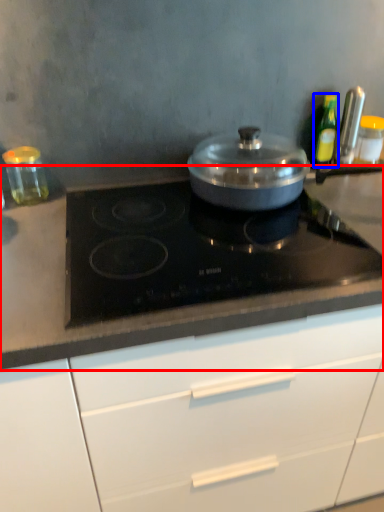
Question: Which object appears farthest to the camera in this image, countertop (highlighted by a red box) or kitchen appliance (highlighted by a blue box)?

Choices:
 (A) countertop
 (B) kitchen appliance

Answer: (B)